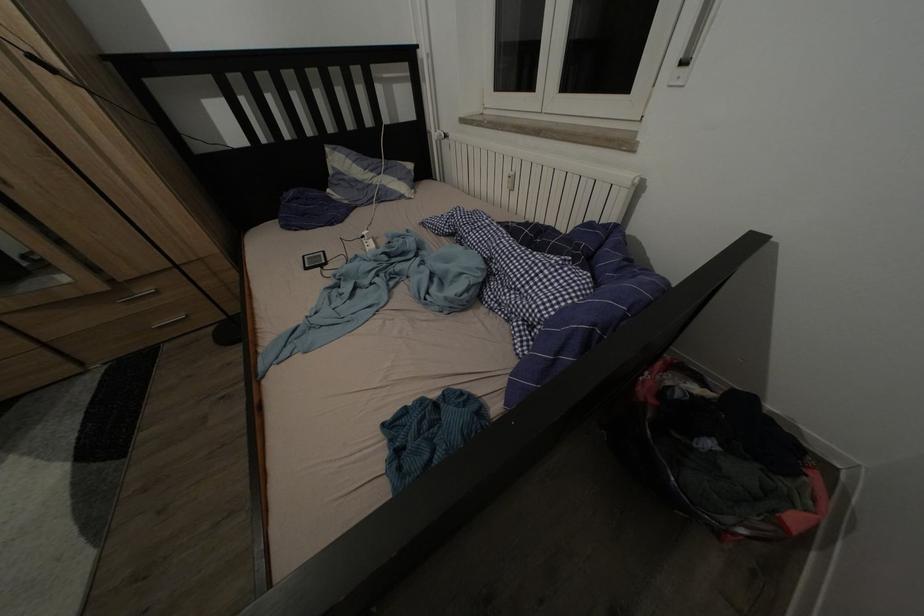
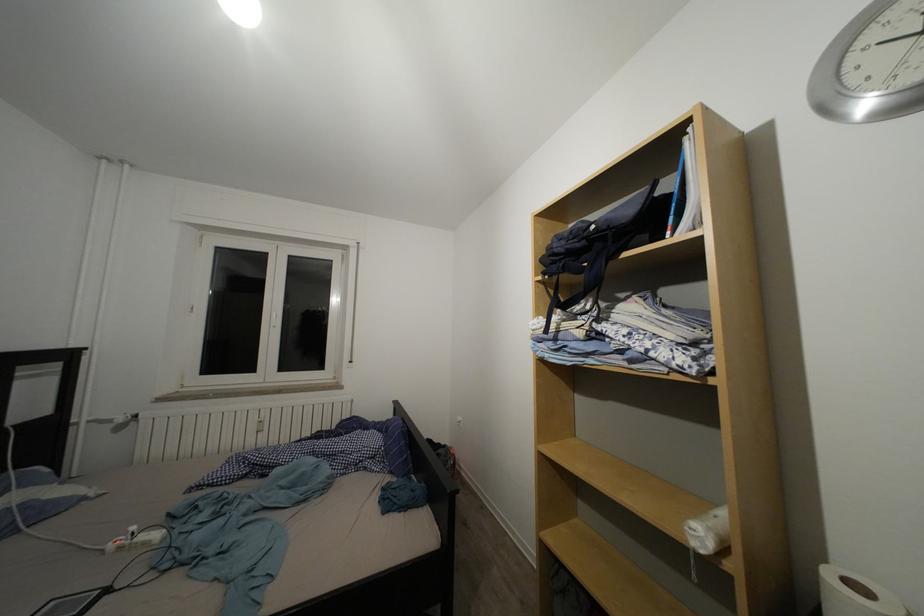
The point at [372,238] is marked in the first image. Where is the corresponding point in the second image?

(140, 533)